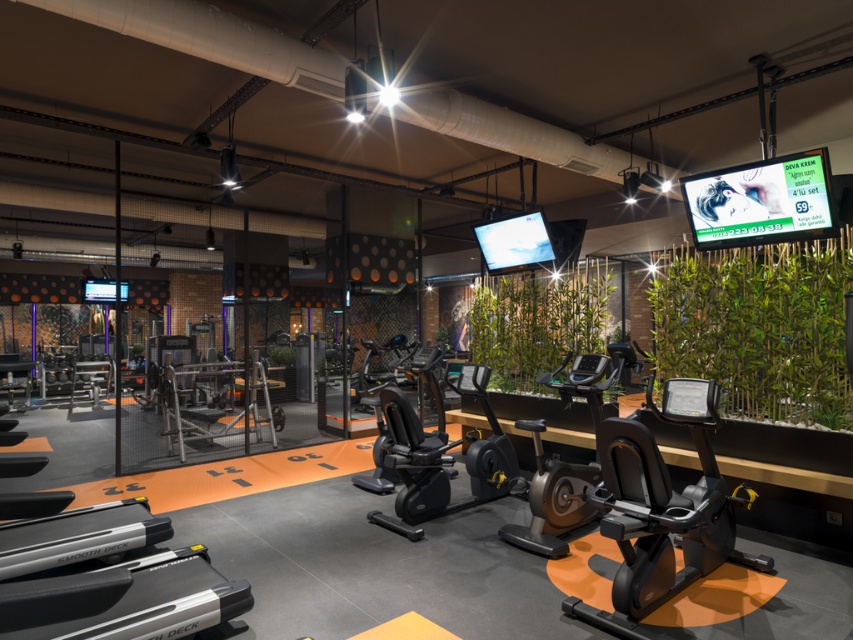
Question: Which of the following is the farthest from the observer?

Choices:
 (A) green leafy plant at center
 (B) green leafy plant at right

Answer: (A)

Question: Does green leafy plant at right lie in front of green leafy plant at center?

Choices:
 (A) no
 (B) yes

Answer: (B)

Question: Can you confirm if green leafy plant at right is positioned to the left of green leafy plant at center?

Choices:
 (A) yes
 (B) no

Answer: (B)

Question: Is green leafy plant at right further to the viewer compared to green leafy plant at center?

Choices:
 (A) yes
 (B) no

Answer: (B)

Question: Which object is closer to the camera taking this photo?

Choices:
 (A) green leafy plant at right
 (B) green leafy plant at center

Answer: (A)